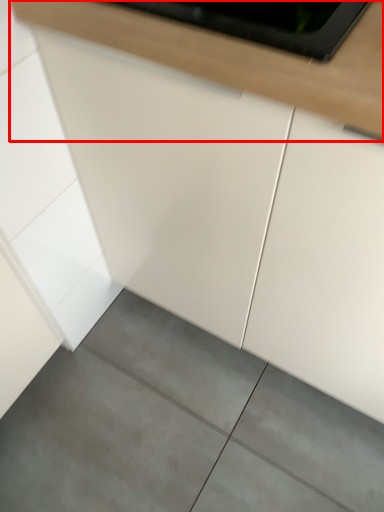
Question: Where is countertop (annotated by the red box) located in relation to concrete in the image?

Choices:
 (A) left
 (B) right

Answer: (B)